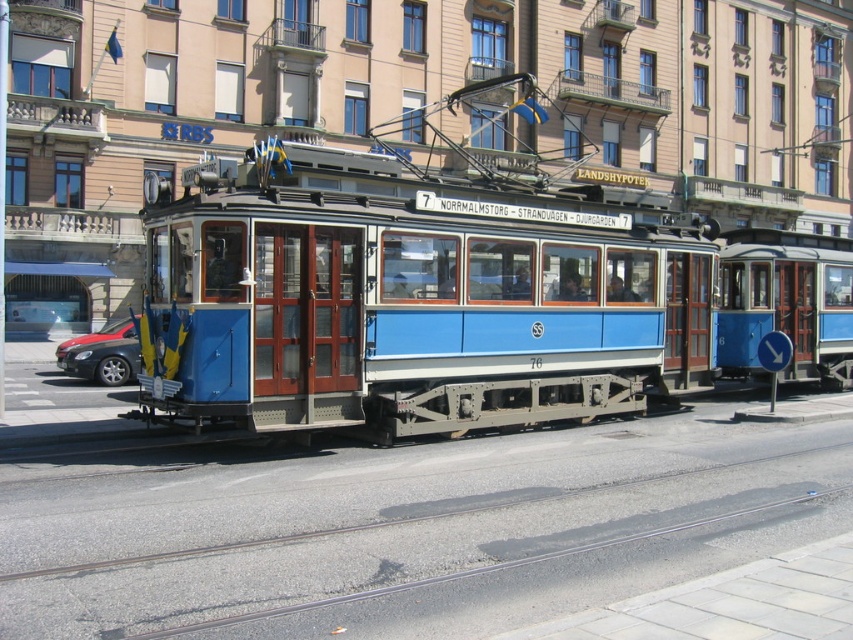
Question: Based on their relative distances, which object is nearer to the shiny black sedan at left?

Choices:
 (A) blue polished wood tram at center
 (B) metal/smooth track at lower center

Answer: (A)

Question: From the image, what is the correct spatial relationship of blue polished wood tram at center in relation to shiny black sedan at left?

Choices:
 (A) above
 (B) below

Answer: (A)

Question: Which of these objects is positioned farthest from the metal/smooth track at lower center?

Choices:
 (A) shiny black sedan at left
 (B) blue polished wood tram at center
 (C) red glossy car at left

Answer: (C)

Question: Which point is farther from the camera taking this photo?

Choices:
 (A) (120, 358)
 (B) (668, 493)

Answer: (A)

Question: Can you confirm if blue polished wood tram at center is positioned to the right of shiny black sedan at left?

Choices:
 (A) no
 (B) yes

Answer: (B)

Question: Is metal/smooth track at lower center positioned before shiny black sedan at left?

Choices:
 (A) yes
 (B) no

Answer: (A)